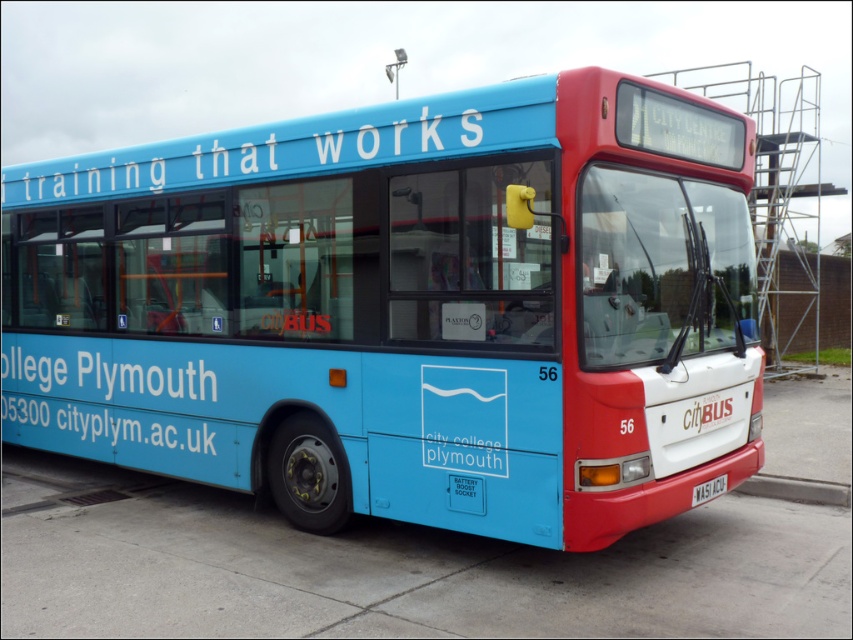
Question: Observing the image, what is the correct spatial positioning of blue matte text at lower left in reference to black plastic license plate at lower right?

Choices:
 (A) below
 (B) above

Answer: (B)

Question: Does matte blue bus at center appear under black plastic license plate at lower right?

Choices:
 (A) no
 (B) yes

Answer: (A)

Question: Which object is positioned closest to the blue matte text at lower left?

Choices:
 (A) matte blue bus at center
 (B) gray concrete curb at lower right

Answer: (A)

Question: Which point is farther from the camera taking this photo?

Choices:
 (A) (570, 92)
 (B) (793, 490)
 (C) (198, 442)
 (D) (706, 486)

Answer: (B)

Question: Among these points, which one is farthest from the camera?

Choices:
 (A) (32, 388)
 (B) (695, 493)
 (C) (639, 372)

Answer: (A)

Question: Is the position of blue matte text at lower left less distant than that of black plastic license plate at lower right?

Choices:
 (A) no
 (B) yes

Answer: (A)